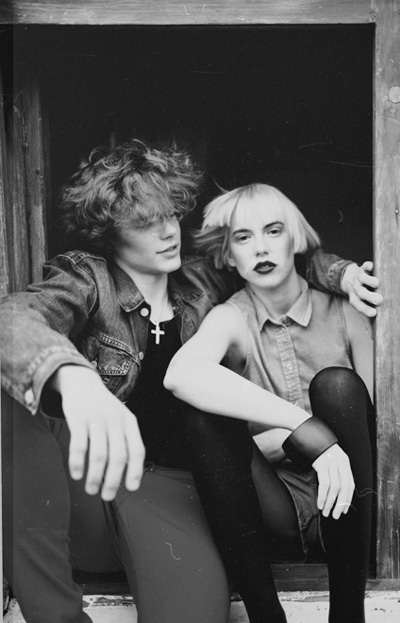
At what (x,y) coordinates should I click in order to perform the action: click on door frame. Please return your answer as a coordinate pair (x, y). The height and width of the screenshot is (623, 400). Looking at the image, I should click on (397, 72), (65, 12), (33, 215).